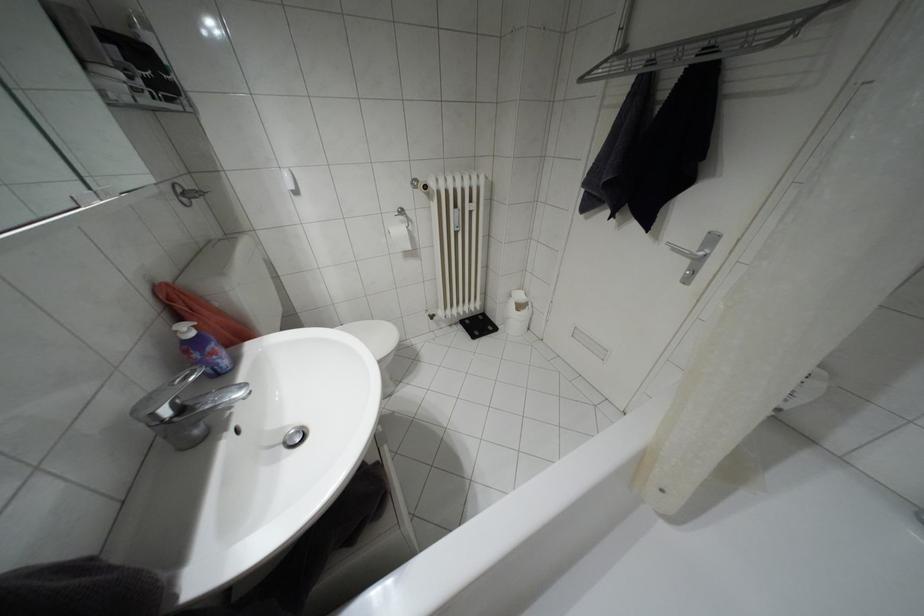
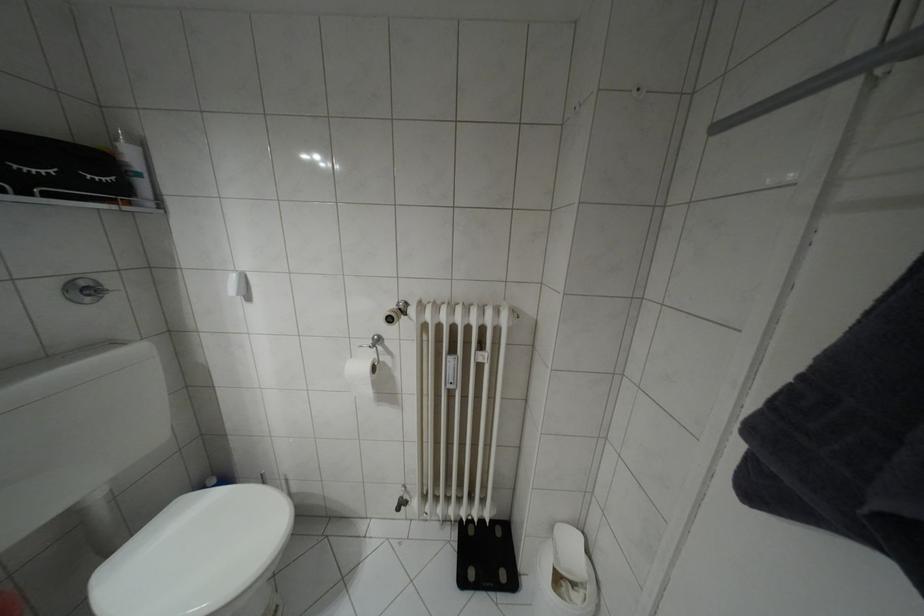
Where in the second image is the point corresponding to point (531, 313) from the first image?

(598, 606)